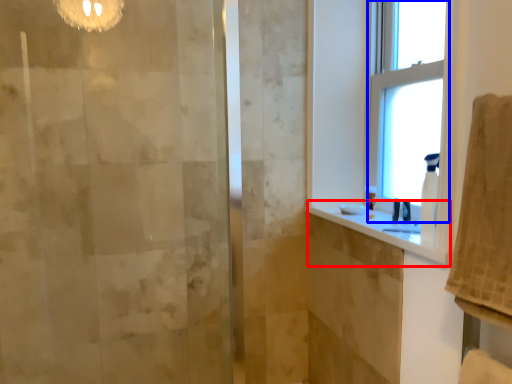
Question: Which point is closer to the camera, counter top (highlighted by a red box) or window (highlighted by a blue box)?

Choices:
 (A) counter top
 (B) window

Answer: (A)